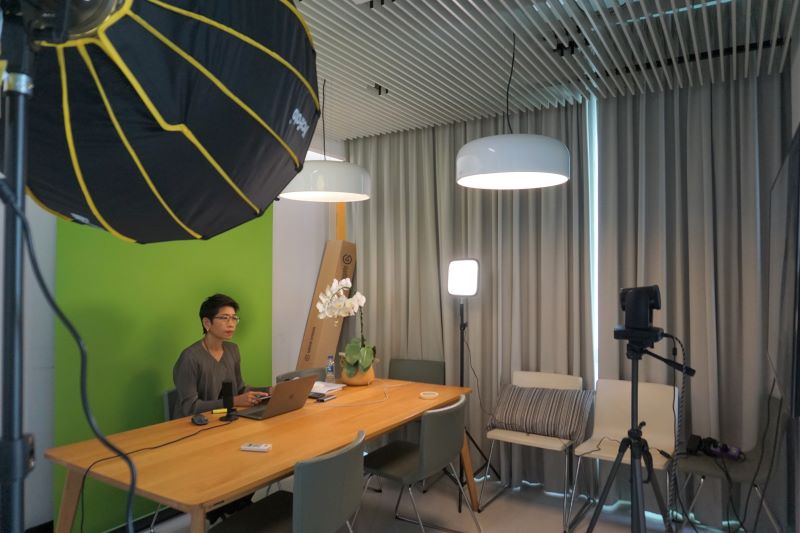
The image size is (800, 533). Find the location of `wood grain desk`. wood grain desk is located at coordinates (x=320, y=437).